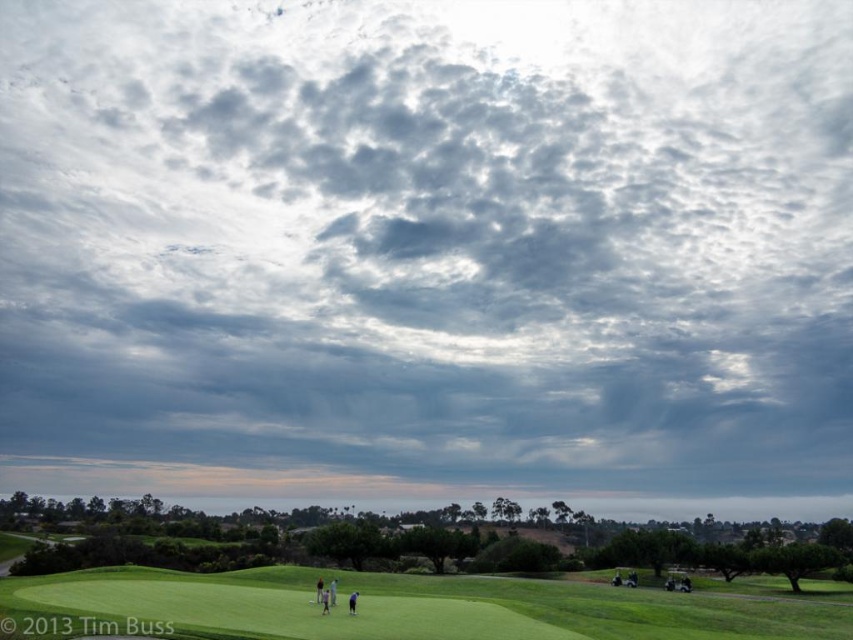
You are a golfer standing on the green grassy field at lower center and you see the dark blue shirt at lower center. Which object takes up more space in the image?

The green grassy field at lower center has a larger size compared to the dark blue shirt at lower center, so it takes up more space in the image.

Looking at this image, you are a golfer standing at point (357, 595) and want to hit a ball to point (427, 592). Considering the golf course layout described, will your target point be in front of or behind your current position?

The point (427, 592) is behind point (357, 595), so your target is behind your current position.

You are a golfer standing on the green grassy field at lower center and you see the dark blue shirt at lower center. Which object is wider?

The green grassy field at lower center might be wider than dark blue shirt at lower center.